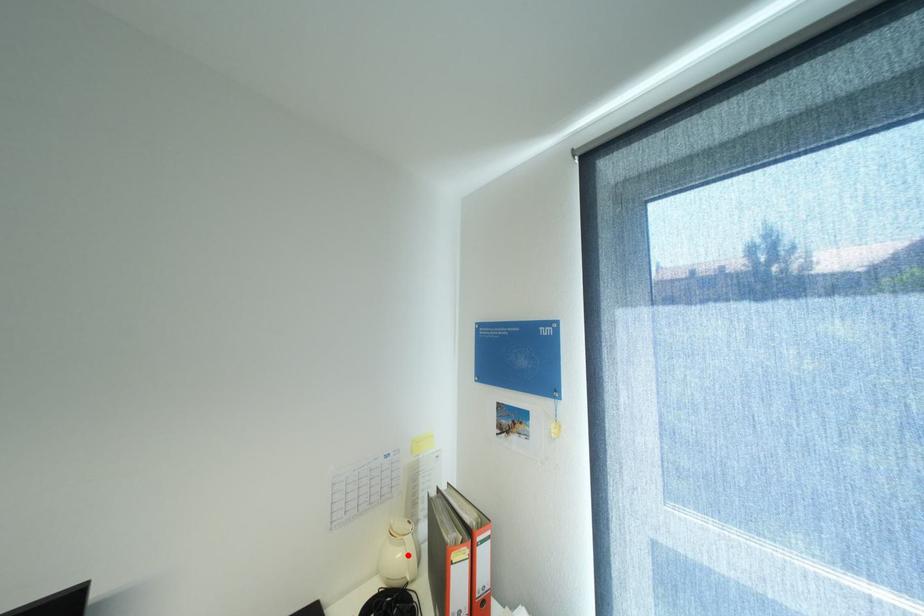
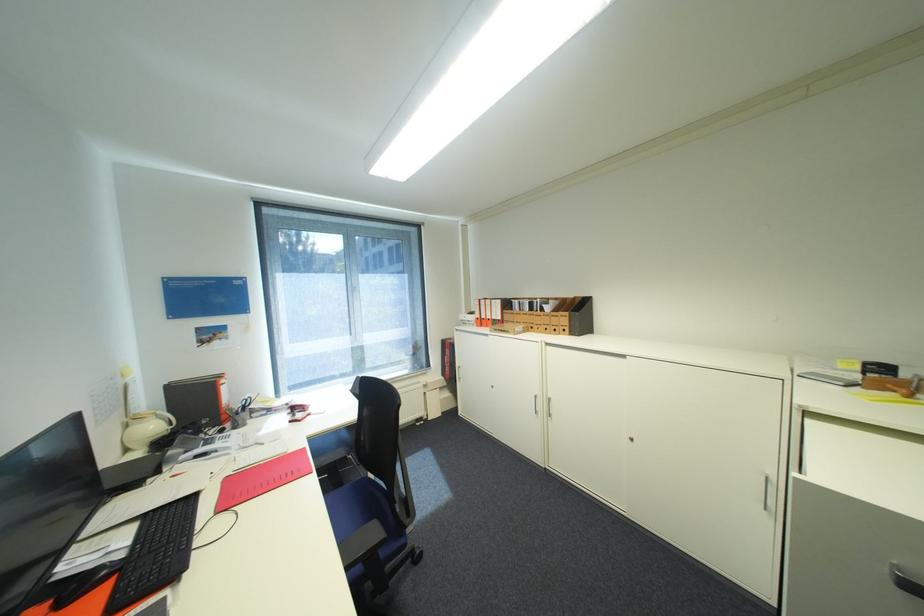
Find the pixel in the second image that matches the highlighted location in the first image.

(161, 427)